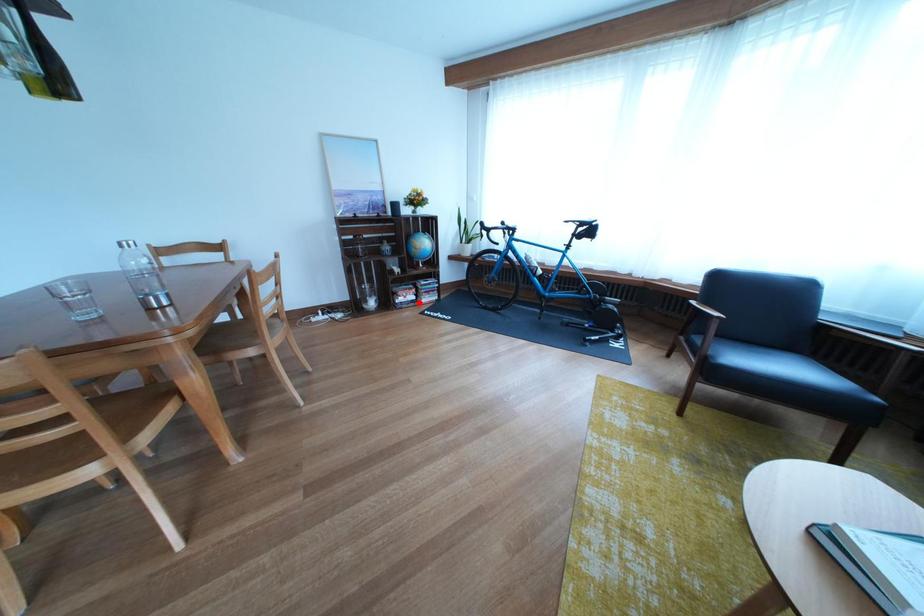
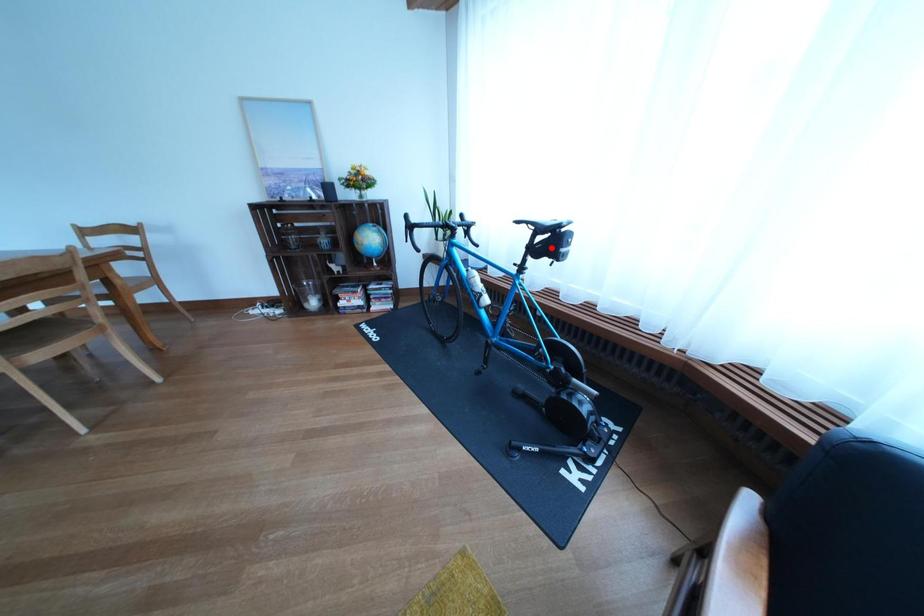
I am providing you with two images of the same scene from different viewpoints. A red point is marked on the first image and another point is marked on the second image. Do the highlighted points in image1 and image2 indicate the same real-world spot?

No